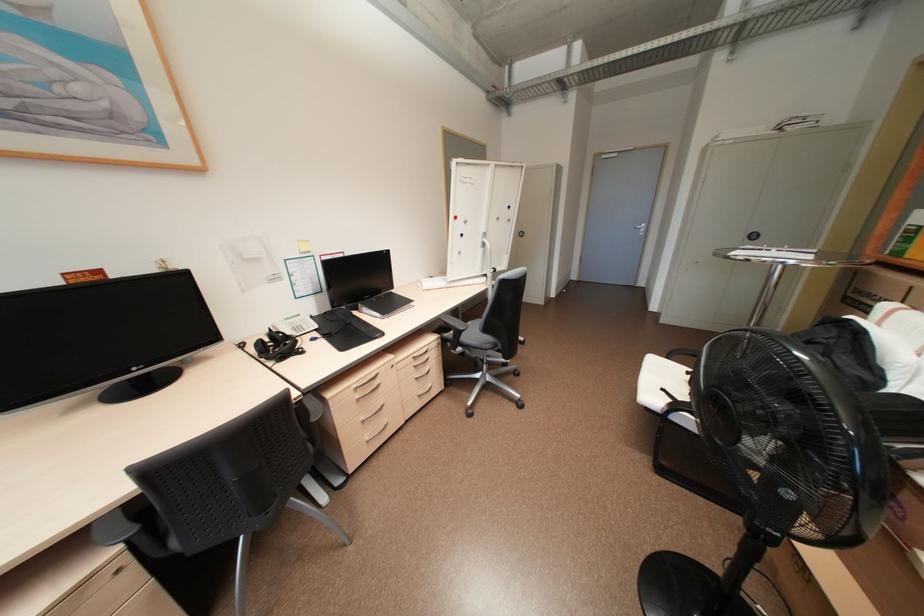
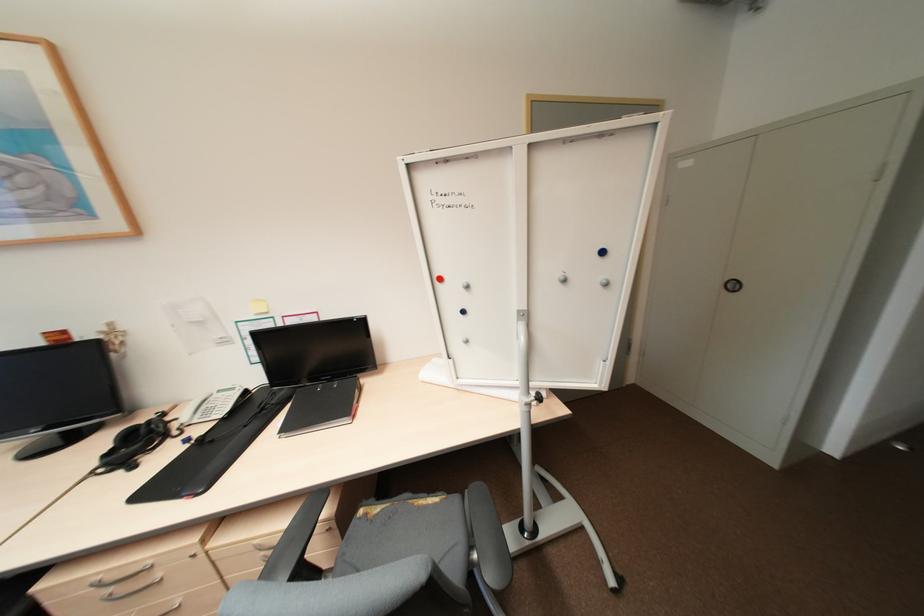
Where in the second image is the point corresponding to point (515, 220) from the first image?

(612, 284)